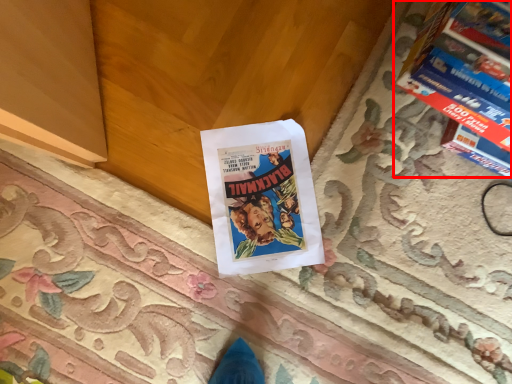
Question: From the image's perspective, considering the relative positions of magazine (annotated by the red box) and book in the image provided, where is magazine (annotated by the red box) located with respect to the staircase?

Choices:
 (A) below
 (B) above

Answer: (B)